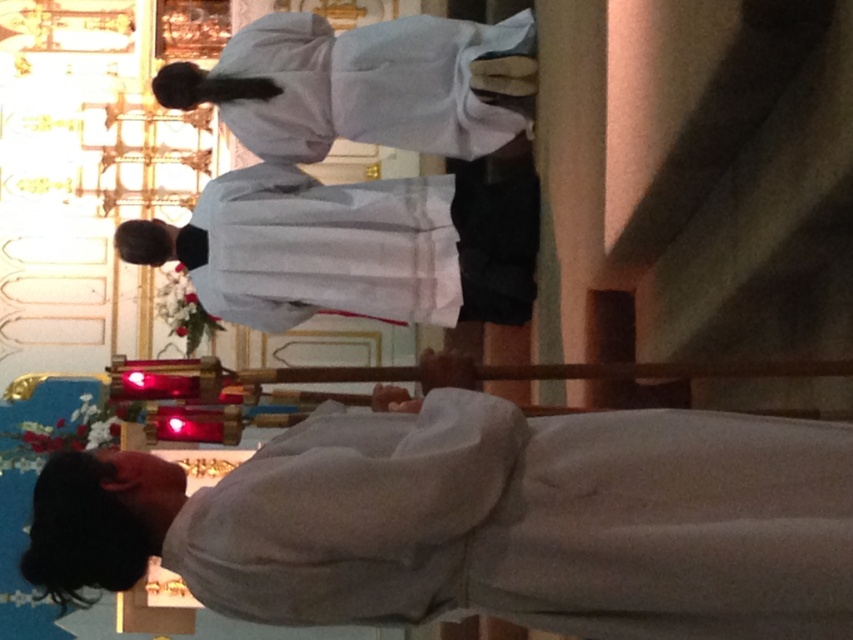
You are standing in the church and want to place a small candle on the exact location of the point labeled as point (532, 522). Based on the scene description, what object or feature will the candle be placed on?

The candle will be placed on the white soft cloth at lower center, as the point (532, 522) corresponds to this object according to the description.

You are standing in the church and want to place a small candle on the white soft cloth at lower center. Based on the image, can you confirm if the cloth is large enough to hold the candle without it falling off?

The white soft cloth at lower center is located at point (532, 522), but the size of the cloth isnno provided in the Objects Description. Therefore, it is unclear if the candle will fit securely.